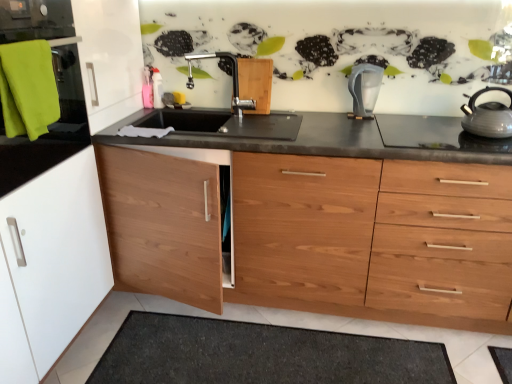
Question: From the image's perspective, does dark gray textured bath mat at lower center appear lower than matte silver faucet at center?

Choices:
 (A) yes
 (B) no

Answer: (A)

Question: Can we say dark gray textured bath mat at lower center lies outside matte silver faucet at center?

Choices:
 (A) yes
 (B) no

Answer: (A)

Question: From the image's perspective, is dark gray textured bath mat at lower center on matte silver faucet at center?

Choices:
 (A) no
 (B) yes

Answer: (A)

Question: Could you tell me if dark gray textured bath mat at lower center is turned towards matte silver faucet at center?

Choices:
 (A) yes
 (B) no

Answer: (B)

Question: Is dark gray textured bath mat at lower center to the left of matte silver faucet at center from the viewer's perspective?

Choices:
 (A) no
 (B) yes

Answer: (A)

Question: Is dark gray textured bath mat at lower center far away from matte silver faucet at center?

Choices:
 (A) yes
 (B) no

Answer: (A)

Question: From a real-world perspective, is black granite countertop at center below shiny silver gas stove at right?

Choices:
 (A) yes
 (B) no

Answer: (A)

Question: Is black granite countertop at center oriented away from shiny silver gas stove at right?

Choices:
 (A) no
 (B) yes

Answer: (A)

Question: Can you confirm if black granite countertop at center is bigger than shiny silver gas stove at right?

Choices:
 (A) no
 (B) yes

Answer: (B)

Question: Does black granite countertop at center have a greater width compared to shiny silver gas stove at right?

Choices:
 (A) no
 (B) yes

Answer: (B)

Question: Can you confirm if black granite countertop at center is shorter than shiny silver gas stove at right?

Choices:
 (A) yes
 (B) no

Answer: (B)

Question: Is black granite countertop at center next to shiny silver gas stove at right?

Choices:
 (A) yes
 (B) no

Answer: (B)

Question: Is shiny silver gas stove at right at the back of transparent plastic water filter at center?

Choices:
 (A) yes
 (B) no

Answer: (B)